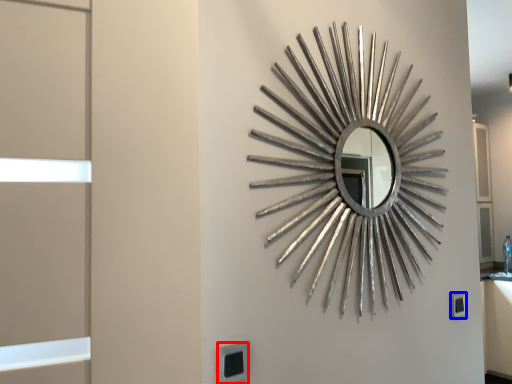
Question: Among these objects, which one is farthest to the camera, electric outlet (highlighted by a red box) or electric outlet (highlighted by a blue box)?

Choices:
 (A) electric outlet
 (B) electric outlet

Answer: (B)